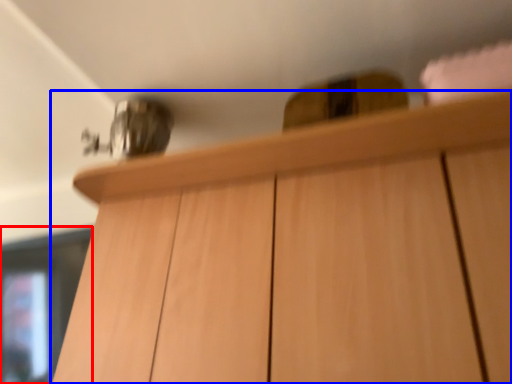
Question: Which of the following is the closest to the observer, glass door (highlighted by a red box) or cabinetry (highlighted by a blue box)?

Choices:
 (A) glass door
 (B) cabinetry

Answer: (B)